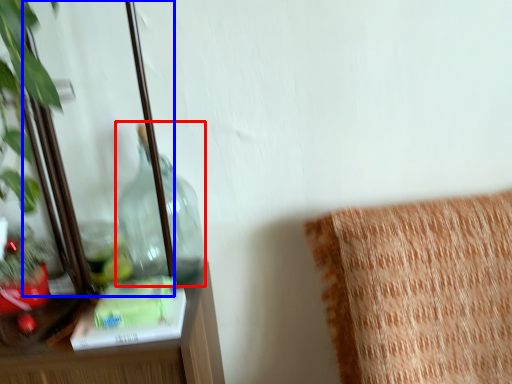
Question: Among these objects, which one is farthest to the camera, bottle (highlighted by a red box) or mirror (highlighted by a blue box)?

Choices:
 (A) bottle
 (B) mirror

Answer: (A)